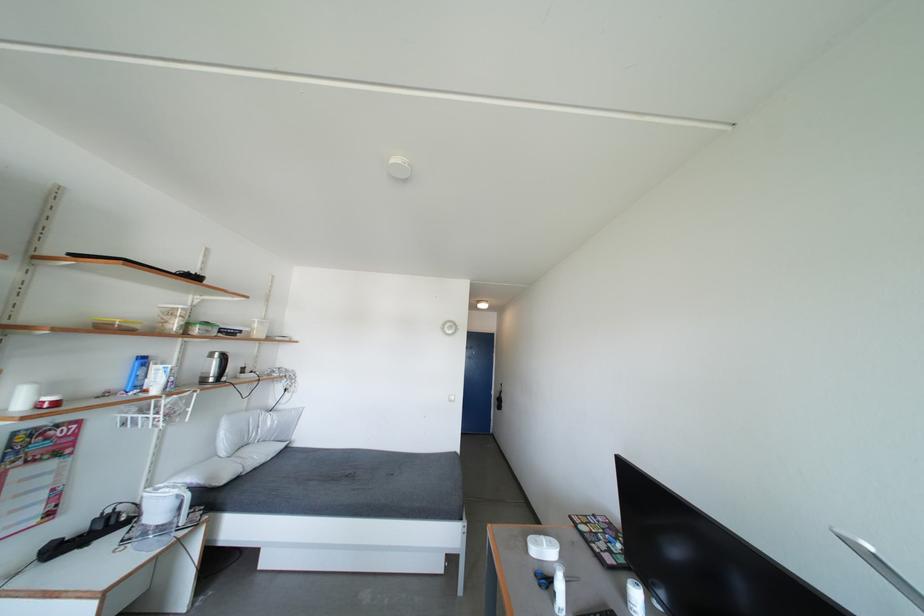
This screenshot has height=616, width=924. I want to click on white light switch, so click(451, 398).